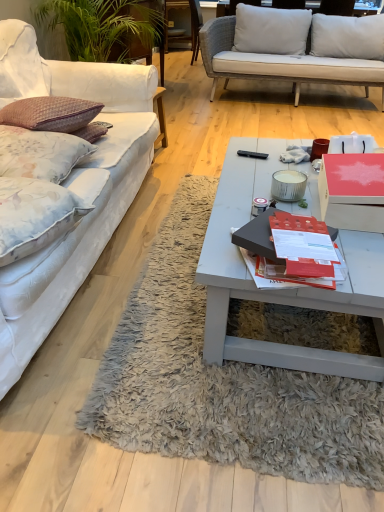
Question: Does point (269, 229) appear closer or farther from the camera than point (41, 244)?

Choices:
 (A) farther
 (B) closer

Answer: (B)

Question: In the image, is matte black book at center on the left side or the right side of floral fabric pillow at left, arranged as the 1th pillow when viewed from the front?

Choices:
 (A) right
 (B) left

Answer: (A)

Question: Based on their relative distances, which object is nearer to the wooden chair at upper center?

Choices:
 (A) floral fabric pillow at left, which appears as the 2th pillow when viewed from the front
 (B) matte gray coffee table at center
 (C) red cardboard box at center
 (D) matte black book at center
 (E) white fabric couch at left

Answer: (E)

Question: Estimate the real-world distances between objects in this image. Which object is closer to the matte gray coffee table at center?

Choices:
 (A) white fabric couch at left
 (B) wooden chair at upper center
 (C) matte black book at center
 (D) red cardboard box at center
 (E) floral fabric pillow at left, marked as the second pillow in a back-to-front arrangement

Answer: (C)